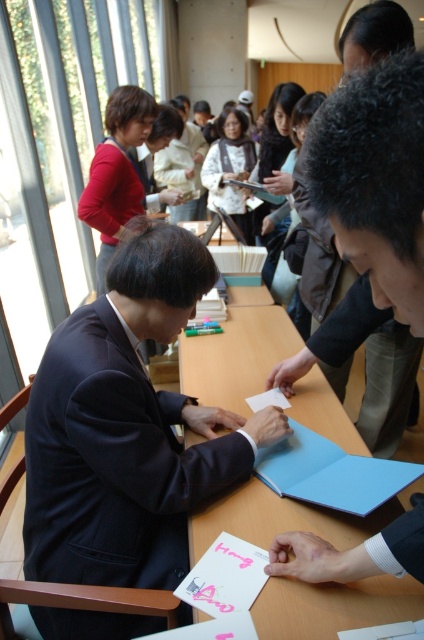
Between wooden table at center and white paper at center, which one appears on the left side from the viewer's perspective?

wooden table at center

Between wooden table at center and white paper at center, which one has more height?

With more height is wooden table at center.

In order to click on wooden table at center in this screenshot , I will do `click(236, 355)`.

Does matte red sweater at upper left appear over pink matte card at lower center?

Yes.

Is matte red sweater at upper left smaller than pink matte card at lower center?

No, matte red sweater at upper left is not smaller than pink matte card at lower center.

Who is more forward, (x=120, y=209) or (x=257, y=547)?

Point (x=257, y=547) is in front.

At what (x,y) coordinates should I click in order to perform the action: click on matte red sweater at upper left. Please return your answer as a coordinate pair (x, y). The image size is (424, 640). Looking at the image, I should click on (119, 173).

Is point (326, 538) farther from viewer compared to point (128, 157)?

No, (326, 538) is in front of (128, 157).

Is wooden table at center taller than matte red sweater at upper left?

No, wooden table at center is not taller than matte red sweater at upper left.

Image resolution: width=424 pixels, height=640 pixels. In order to click on wooden table at center in this screenshot , I will do `click(236, 355)`.